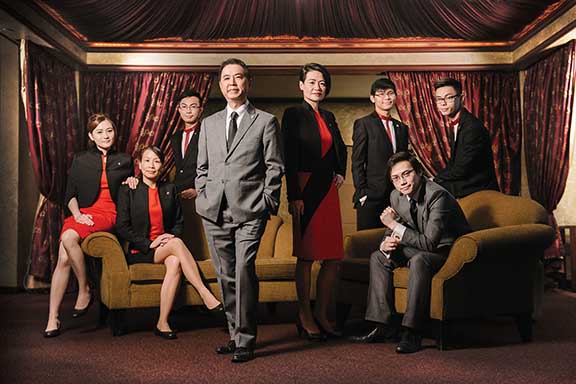
Locate an element on the screen. This screenshot has height=384, width=576. carpet is located at coordinates (69, 357), (162, 355), (314, 355), (473, 367).